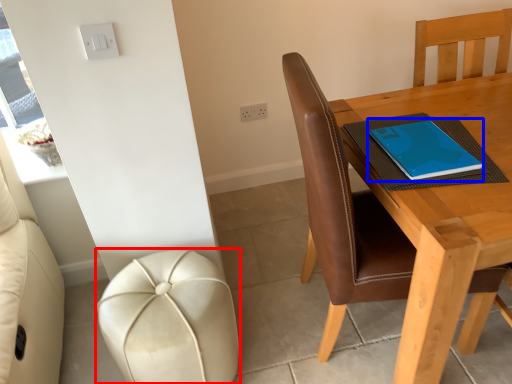
Question: Which object is further to the camera taking this photo, stool (highlighted by a red box) or notebook (highlighted by a blue box)?

Choices:
 (A) stool
 (B) notebook

Answer: (B)